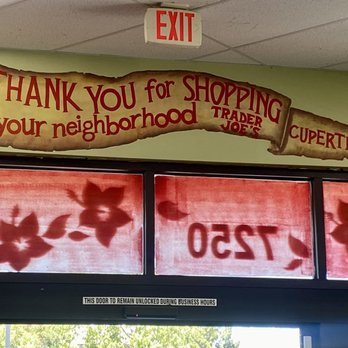
Find the location of a particular element. The height and width of the screenshot is (348, 348). door is located at coordinates (109, 336).